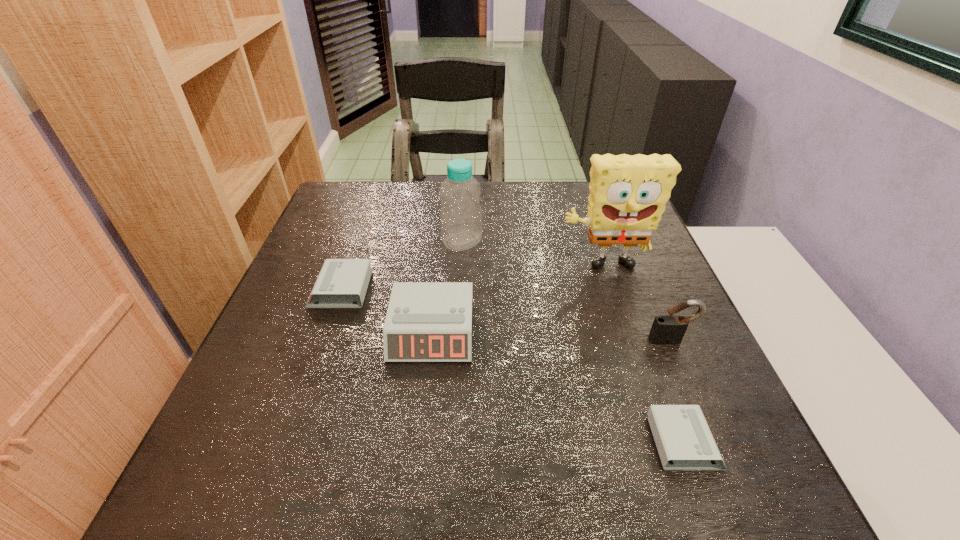
Please point a location where one more alarm_clock can be added evenly. Please provide its 2D coordinates. Your answer should be formatted as a tuple, i.e. [(x, y)], where the tuple contains the x and y coordinates of a point satisfying the conditions above.

[(543, 380)]